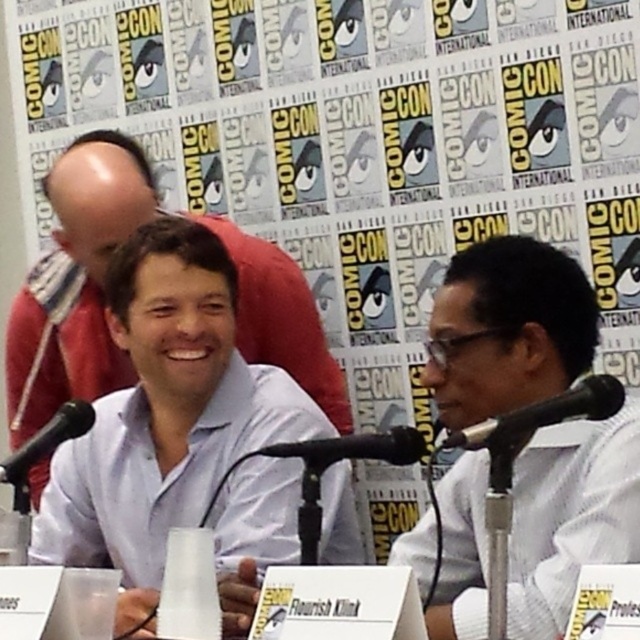
You are attending a panel at Comic Con and need to introduce the speaker wearing the white textured shirt at right. Which direction should you look from the black matte microphone at left to locate them?

The white textured shirt at right is to the right of the black matte microphone at left, so you should look to the right from the microphone to locate the speaker.

You are attending Comic Con and want to take a photo of the panelists. You notice the white textured shirt at right and the black matte microphone at center. Which object should you focus on first if you want to capture both in the same frame without moving your camera?

The white textured shirt at right is positioned on the left side of the black matte microphone at center, so you should focus on the white textured shirt at right first to ensure both are in frame.

You are organizing a panel discussion at Comic Con and need to ensure that the two black matte microphones are spaced appropriately. Given that the black matte microphone at center might be wider than the black matte microphone at left, what should you consider when placing them on the table?

Since the black matte microphone at center might be wider than the black matte microphone at left, you should ensure there is sufficient space between them to accommodate the larger size of the center microphone, preventing overcrowding on the table.